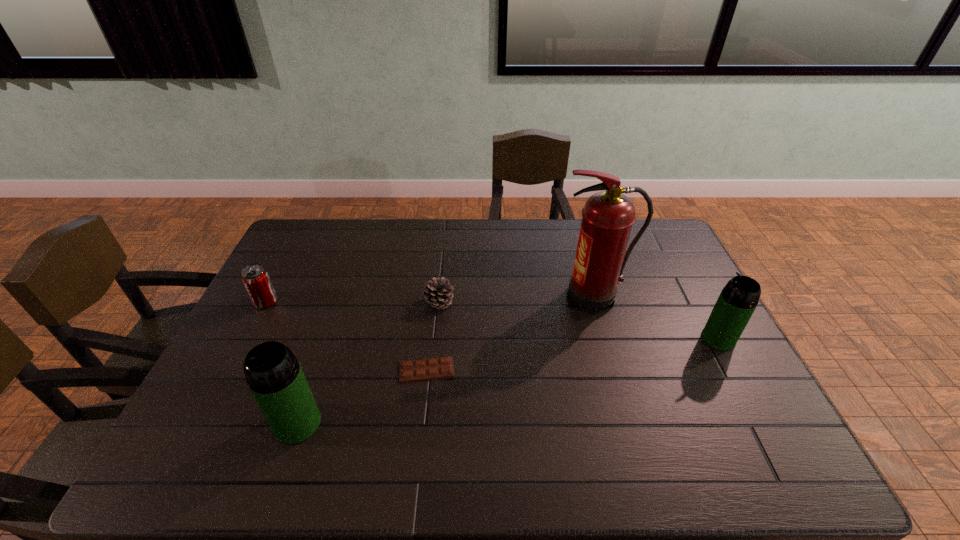
Where is `the second tallest object`? The image size is (960, 540). the second tallest object is located at coordinates (275, 378).

The width and height of the screenshot is (960, 540). Find the location of `the nearer thermos bottle`. the nearer thermos bottle is located at coordinates (275, 378).

The image size is (960, 540). I want to click on the fourth shortest object, so click(x=736, y=303).

Locate an element on the screen. the rightmost object is located at coordinates (736, 303).

The height and width of the screenshot is (540, 960). Find the location of `the fifth tallest object`. the fifth tallest object is located at coordinates (437, 294).

The image size is (960, 540). Identify the location of the fifth object from left to right. (608, 216).

Locate an element on the screen. the tallest object is located at coordinates (608, 216).

I want to click on chocolate bar, so click(x=410, y=371).

Identify the location of the fifth farthest object. (410, 371).

Identify the location of pop soda. This screenshot has width=960, height=540. (255, 278).